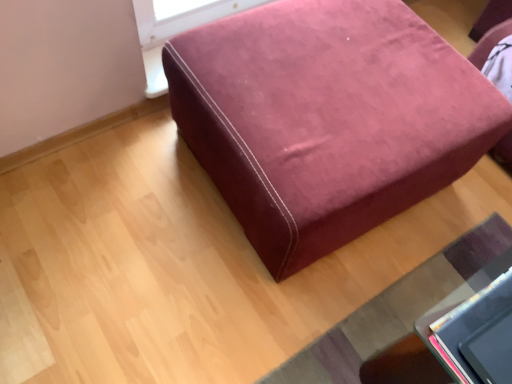
Question: From the image's perspective, relative to velvet-like burgundy ottoman at lower right, is velvet-like burgundy ottoman at center above or below?

Choices:
 (A) above
 (B) below

Answer: (A)

Question: Is velvet-like burgundy ottoman at center wider or thinner than velvet-like burgundy ottoman at lower right?

Choices:
 (A) thin
 (B) wide

Answer: (B)

Question: Considering the positions of velvet-like burgundy ottoman at center and velvet-like burgundy ottoman at lower right in the image, is velvet-like burgundy ottoman at center bigger or smaller than velvet-like burgundy ottoman at lower right?

Choices:
 (A) small
 (B) big

Answer: (B)

Question: Is velvet-like burgundy ottoman at lower right situated inside velvet-like burgundy ottoman at center or outside?

Choices:
 (A) outside
 (B) inside

Answer: (A)

Question: From their relative heights in the image, would you say velvet-like burgundy ottoman at lower right is taller or shorter than velvet-like burgundy ottoman at center?

Choices:
 (A) tall
 (B) short

Answer: (B)

Question: Relative to velvet-like burgundy ottoman at center, is velvet-like burgundy ottoman at lower right in front or behind?

Choices:
 (A) behind
 (B) front

Answer: (A)

Question: From the image's perspective, is velvet-like burgundy ottoman at lower right located above or below velvet-like burgundy ottoman at center?

Choices:
 (A) above
 (B) below

Answer: (B)